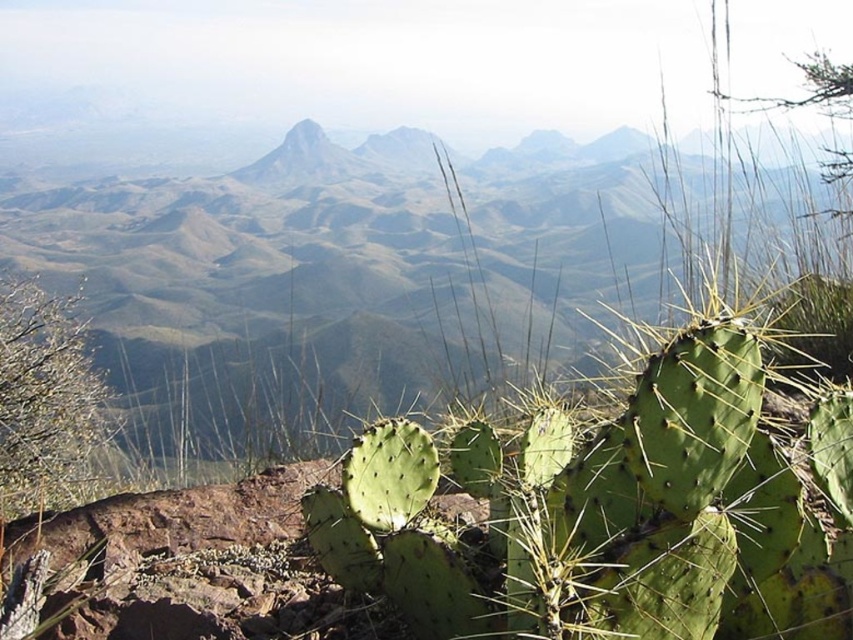
Question: Which object is positioned closest to the green textured mountain range at center?

Choices:
 (A) green spiny cactus at lower left
 (B) green spiny cactus at center

Answer: (A)

Question: Which object appears closest to the camera in this image?

Choices:
 (A) green textured mountain range at center
 (B) green spiny cactus at lower left
 (C) green spiny cactus at center

Answer: (C)

Question: Which object is closer to the camera taking this photo?

Choices:
 (A) green spiny cactus at center
 (B) green spiny cactus at lower left
 (C) green textured mountain range at center

Answer: (A)

Question: Can you confirm if green textured mountain range at center is bigger than green spiny cactus at center?

Choices:
 (A) yes
 (B) no

Answer: (A)

Question: Is green spiny cactus at center positioned in front of green spiny cactus at lower left?

Choices:
 (A) yes
 (B) no

Answer: (A)

Question: Does green textured mountain range at center have a larger size compared to green spiny cactus at lower left?

Choices:
 (A) yes
 (B) no

Answer: (A)